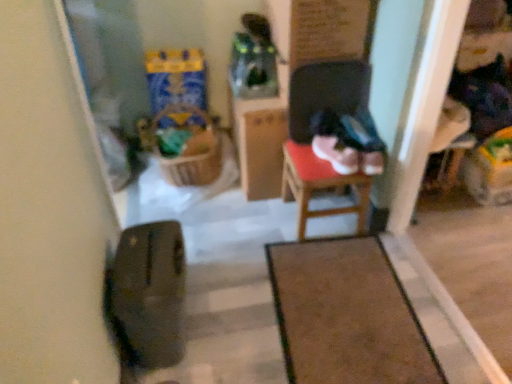
Where is `free space in front of woven brown laundry basket at center`? Image resolution: width=512 pixels, height=384 pixels. free space in front of woven brown laundry basket at center is located at coordinates (187, 205).